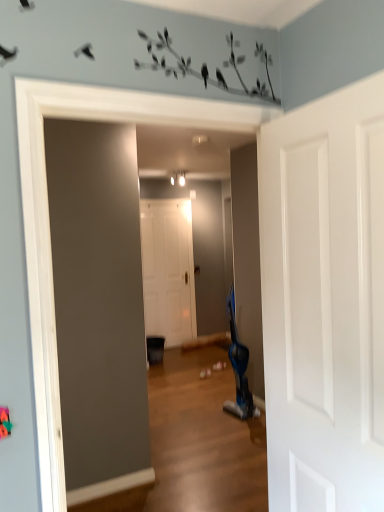
Image resolution: width=384 pixels, height=512 pixels. Find the location of `white glossy door at upper right, marked as the first door in a right-to-left arrangement`. white glossy door at upper right, marked as the first door in a right-to-left arrangement is located at coordinates (324, 301).

Where is `blue plastic swivel chair at center-right`? blue plastic swivel chair at center-right is located at coordinates (239, 370).

This screenshot has width=384, height=512. What do you see at coordinates (239, 370) in the screenshot? I see `blue plastic swivel chair at center-right` at bounding box center [239, 370].

Find the location of a particular element. The image size is (384, 512). white matte door at center, which is counted as the 1th door, starting from the back is located at coordinates (168, 270).

Can you tell me how much white glossy door at upper right, marked as the first door in a right-to-left arrangement, and blue plastic swivel chair at center-right differ in facing direction?

white glossy door at upper right, marked as the first door in a right-to-left arrangement, and blue plastic swivel chair at center-right are facing 6.84 degrees away from each other.

From the picture: Considering the positions of objects white glossy door at upper right, the first door when ordered from front to back, and blue plastic swivel chair at center-right in the image provided, who is more to the right, white glossy door at upper right, the first door when ordered from front to back, or blue plastic swivel chair at center-right?

blue plastic swivel chair at center-right is more to the right.

Relative to blue plastic swivel chair at center-right, is white glossy door at upper right, which ranks as the second door in back-to-front order, in front or behind?

white glossy door at upper right, which ranks as the second door in back-to-front order, is in front of blue plastic swivel chair at center-right.

Locate an element on the screen. swivel chair that is on the right side of white glossy door at upper right, the first door when ordered from front to back is located at coordinates (239, 370).

Identify the location of door that appears in front of the white matte door at center, the second door from the right. (324, 301).

Between white glossy door at upper right, the first door when ordered from front to back, and white matte door at center, the second door from the right, which one appears on the right side from the viewer's perspective?

white glossy door at upper right, the first door when ordered from front to back.

Is white glossy door at upper right, the first door when ordered from front to back, inside the boundaries of white matte door at center, which is the 1th door in left-to-right order, or outside?

white glossy door at upper right, the first door when ordered from front to back, exists outside the volume of white matte door at center, which is the 1th door in left-to-right order.

How distant is blue plastic swivel chair at center-right from white matte door at center, which is counted as the 1th door, starting from the back?

blue plastic swivel chair at center-right and white matte door at center, which is counted as the 1th door, starting from the back, are 4.76 feet apart from each other.

Where is `swivel chair on the right of white matte door at center, which is counted as the 1th door, starting from the back`? This screenshot has height=512, width=384. swivel chair on the right of white matte door at center, which is counted as the 1th door, starting from the back is located at coordinates (239, 370).

Considering the relative sizes of blue plastic swivel chair at center-right and white matte door at center, which is counted as the 1th door, starting from the back, in the image provided, is blue plastic swivel chair at center-right shorter than white matte door at center, which is counted as the 1th door, starting from the back,?

Yes.

Is blue plastic swivel chair at center-right in front of white matte door at center, the second door from the right?

Yes, the depth of blue plastic swivel chair at center-right is less than that of white matte door at center, the second door from the right.

Between white matte door at center, which ranks as the 2th door in front-to-back order, and white glossy door at upper right, which ranks as the second door in back-to-front order, which one has smaller size?

Smaller between the two is white glossy door at upper right, which ranks as the second door in back-to-front order.

Is point (166, 277) positioned in front of point (317, 424)?

No.

The image size is (384, 512). Find the location of `door positioned vertically above the white matte door at center, which ranks as the 2th door in front-to-back order (from a real-world perspective)`. door positioned vertically above the white matte door at center, which ranks as the 2th door in front-to-back order (from a real-world perspective) is located at coordinates (324, 301).

Does white matte door at center, the second door from the right, turn towards white glossy door at upper right, which ranks as the second door in back-to-front order?

No, white matte door at center, the second door from the right, does not turn towards white glossy door at upper right, which ranks as the second door in back-to-front order.

From the picture: Is white matte door at center, which ranks as the 2th door in front-to-back order, at the right side of blue plastic swivel chair at center-right?

Incorrect, white matte door at center, which ranks as the 2th door in front-to-back order, is not on the right side of blue plastic swivel chair at center-right.

In the scene shown: Is white matte door at center, which is counted as the 1th door, starting from the back, outside of blue plastic swivel chair at center-right?

Yes.

Considering the sizes of white matte door at center, the second door from the right, and blue plastic swivel chair at center-right in the image, is white matte door at center, the second door from the right, taller or shorter than blue plastic swivel chair at center-right?

Clearly, white matte door at center, the second door from the right, is taller compared to blue plastic swivel chair at center-right.

Is there a large distance between white matte door at center, which is the 1th door in left-to-right order, and blue plastic swivel chair at center-right?

That's right, there is a large distance between white matte door at center, which is the 1th door in left-to-right order, and blue plastic swivel chair at center-right.

Identify the location of swivel chair lying below the white glossy door at upper right, the first door when ordered from front to back (from the image's perspective). Image resolution: width=384 pixels, height=512 pixels. (239, 370).

Is blue plastic swivel chair at center-right further to the viewer compared to white glossy door at upper right, the first door when ordered from front to back?

Yes, the depth of blue plastic swivel chair at center-right is greater than that of white glossy door at upper right, the first door when ordered from front to back.

Based on the photo, who is smaller, blue plastic swivel chair at center-right or white glossy door at upper right, which ranks as the second door in back-to-front order?

With smaller size is white glossy door at upper right, which ranks as the second door in back-to-front order.

You are a GUI agent. You are given a task and a screenshot of the screen. Output one action in this format:
    pyautogui.click(x=<x>, y=<y>)
    Task: Click on the swivel chair located on the right of white glossy door at upper right, positioned as the second door in left-to-right order
    This screenshot has height=512, width=384.
    Given the screenshot: What is the action you would take?
    pyautogui.click(x=239, y=370)

There is a white matte door at center, which is the 1th door in left-to-right order. Where is `door above it (from a real-world perspective)`? The image size is (384, 512). door above it (from a real-world perspective) is located at coordinates (324, 301).

From the image, which object appears to be nearer to white matte door at center, which is the 1th door in left-to-right order, blue plastic swivel chair at center-right or white glossy door at upper right, the first door when ordered from front to back?

blue plastic swivel chair at center-right is positioned closer to the anchor white matte door at center, which is the 1th door in left-to-right order.

Based on their spatial positions, is white glossy door at upper right, positioned as the second door in left-to-right order, or blue plastic swivel chair at center-right further from white matte door at center, which ranks as the 2th door in front-to-back order?

white glossy door at upper right, positioned as the second door in left-to-right order, lies further to white matte door at center, which ranks as the 2th door in front-to-back order, than the other object.

Which object lies nearer to the anchor point blue plastic swivel chair at center-right, white matte door at center, which is the 1th door in left-to-right order, or white glossy door at upper right, which ranks as the second door in back-to-front order?

white matte door at center, which is the 1th door in left-to-right order, is positioned closer to the anchor blue plastic swivel chair at center-right.

From the image, which object appears to be farther from blue plastic swivel chair at center-right, white glossy door at upper right, marked as the first door in a right-to-left arrangement, or white matte door at center, which ranks as the 2th door in front-to-back order?

The object further to blue plastic swivel chair at center-right is white glossy door at upper right, marked as the first door in a right-to-left arrangement.

When comparing their distances from white glossy door at upper right, positioned as the second door in left-to-right order, does white matte door at center, which ranks as the 2th door in front-to-back order, or blue plastic swivel chair at center-right seem further?

Among the two, white matte door at center, which ranks as the 2th door in front-to-back order, is located further to white glossy door at upper right, positioned as the second door in left-to-right order.

Looking at the image, which one is located further to white glossy door at upper right, positioned as the second door in left-to-right order, blue plastic swivel chair at center-right or white matte door at center, the second door from the right?

The object further to white glossy door at upper right, positioned as the second door in left-to-right order, is white matte door at center, the second door from the right.

Locate an element on the screen. The height and width of the screenshot is (512, 384). swivel chair between white glossy door at upper right, positioned as the second door in left-to-right order, and white matte door at center, which is counted as the 1th door, starting from the back, in the front-back direction is located at coordinates (239, 370).